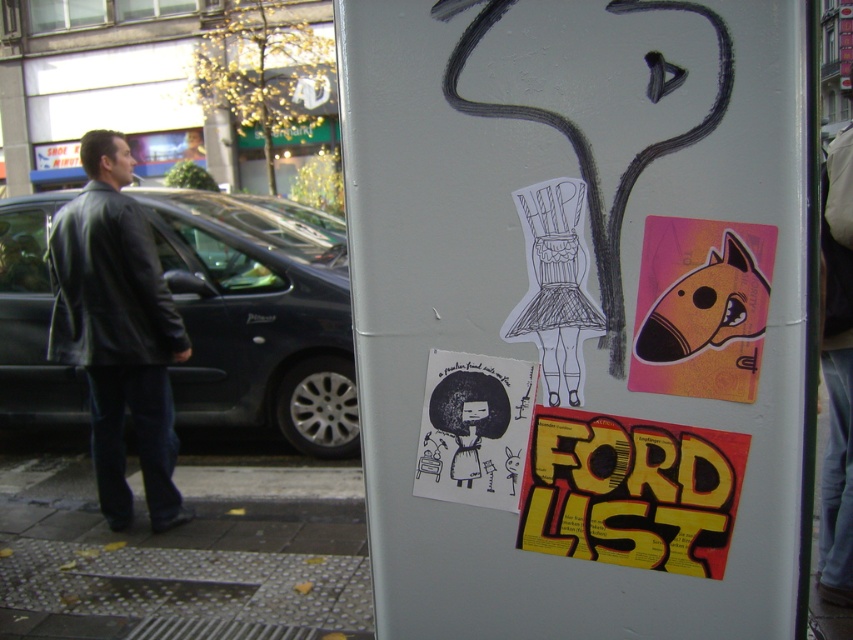
Question: Is black leather jacket at left wider than shiny orange sticker at upper right?

Choices:
 (A) yes
 (B) no

Answer: (A)

Question: Which point is closer to the camera?

Choices:
 (A) [633, 376]
 (B) [113, 353]

Answer: (A)

Question: Which point is farther from the camera taking this photo?

Choices:
 (A) (148, 317)
 (B) (700, 259)

Answer: (A)

Question: Is black leather jacket at left smaller than shiny orange sticker at upper right?

Choices:
 (A) yes
 (B) no

Answer: (B)

Question: Is yellow paper poster at center below black paper poster at center?

Choices:
 (A) yes
 (B) no

Answer: (A)

Question: Which point appears closest to the camera in this image?

Choices:
 (A) tap(158, 429)
 (B) tap(422, 420)
 (C) tap(654, 314)
 (D) tap(537, 468)

Answer: (C)